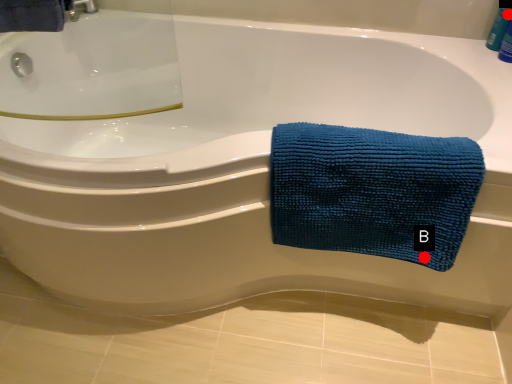
Question: Two points are circled on the image, labeled by A and B beside each circle. Which point is further to the camera?

Choices:
 (A) A is further
 (B) B is further

Answer: (A)